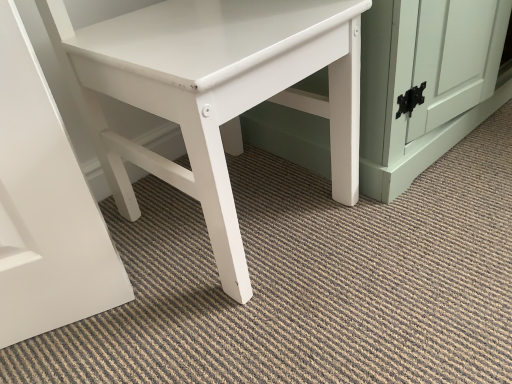
You are a GUI agent. You are given a task and a screenshot of the screen. Output one action in this format:
    pyautogui.click(x=<x>, y=<y>)
    Task: Click on the white matte table at center
    
    Given the screenshot: What is the action you would take?
    pyautogui.click(x=214, y=93)

What do you see at coordinates (214, 93) in the screenshot? I see `white matte table at center` at bounding box center [214, 93].

Identify the location of white matte table at center. (x=214, y=93).